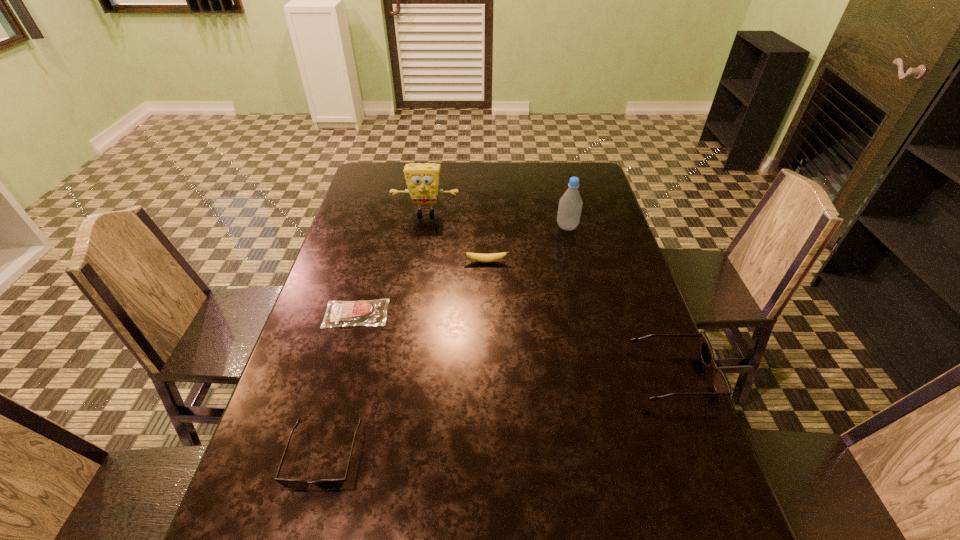
The image size is (960, 540). Identify the location of the nearest object. (294, 484).

Locate an element on the screen. This screenshot has width=960, height=540. the shorter sunglasses is located at coordinates (294, 484).

This screenshot has height=540, width=960. I want to click on the third tallest object, so click(720, 383).

Find the location of a particular element. The width and height of the screenshot is (960, 540). the taller sunglasses is located at coordinates (720, 383).

Identify the location of bottle. This screenshot has height=540, width=960. pos(570,204).

Where is `the fifth nearest object`? This screenshot has width=960, height=540. the fifth nearest object is located at coordinates (570, 204).

Where is `the farthest object`? This screenshot has height=540, width=960. the farthest object is located at coordinates (422, 180).

Identify the location of the fourth nearest object. (479, 257).

Locate an element on the screen. the fifth tallest object is located at coordinates (479, 257).

Find the location of a particular element. This screenshot has height=540, width=960. the third nearest object is located at coordinates (362, 312).